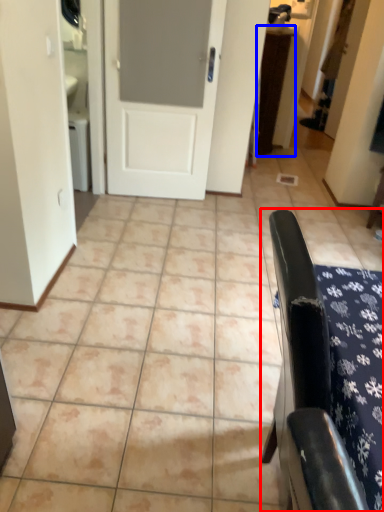
Question: Among these objects, which one is nearest to the camera, furniture (highlighted by a red box) or table (highlighted by a blue box)?

Choices:
 (A) furniture
 (B) table

Answer: (A)